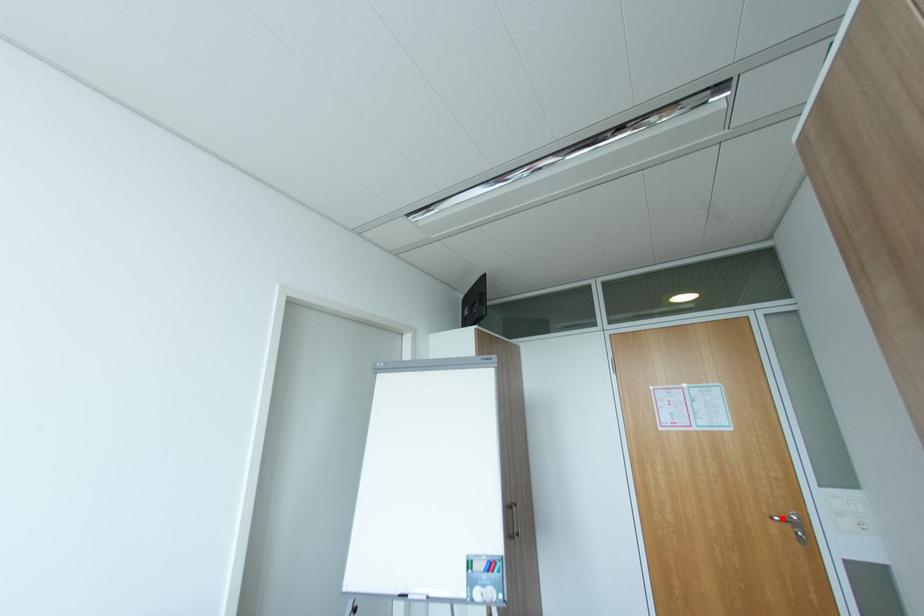
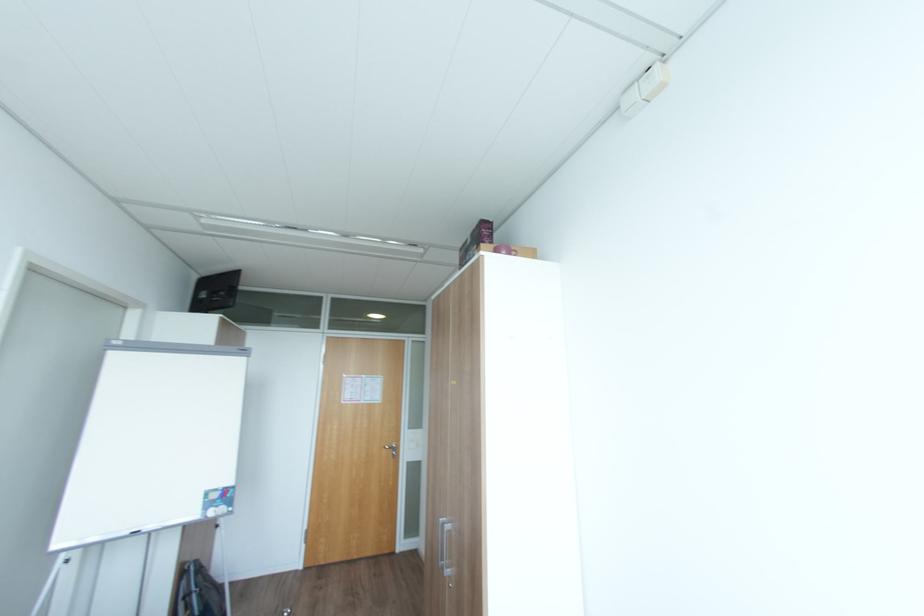
Question: A red point is marked in image1. In image2, is the corresponding 3D point closer to the camera or farther? Reply with the corresponding letter.

Choices:
 (A) The corresponding 3D point is closer.
 (B) The corresponding 3D point is farther.

Answer: (B)